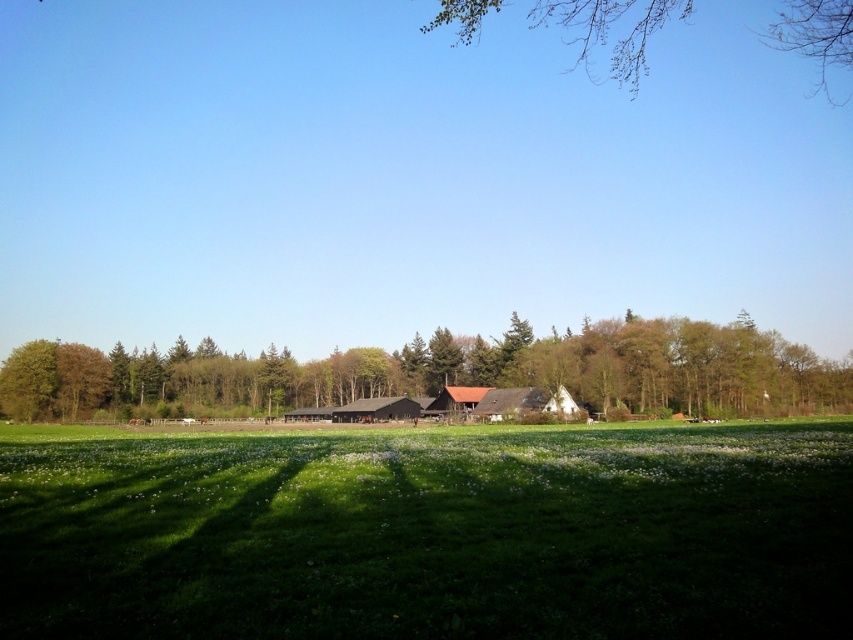
Between point (755, 387) and point (341, 410), which one is positioned behind?

Point (341, 410)

Who is more forward, (654, 396) or (349, 417)?

Point (654, 396) is more forward.

Where is `green leafy tree at center`? green leafy tree at center is located at coordinates (444, 372).

Who is taller, green grassy field at center or dark brown wooden barn at center?

Standing taller between the two is dark brown wooden barn at center.

Can you confirm if green grassy field at center is bigger than dark brown wooden barn at center?

Yes, green grassy field at center is bigger than dark brown wooden barn at center.

Is point (370, 452) positioned in front of point (361, 420)?

That is True.

Identify the location of green grassy field at center. The image size is (853, 640). (428, 532).

Between point (788, 550) and point (622, 339), which one is positioned in front?

Point (788, 550) is more forward.

Between point (454, 435) and point (54, 408), which one is positioned behind?

Point (54, 408)

The image size is (853, 640). Identify the location of green grassy field at center. pyautogui.click(x=428, y=532).